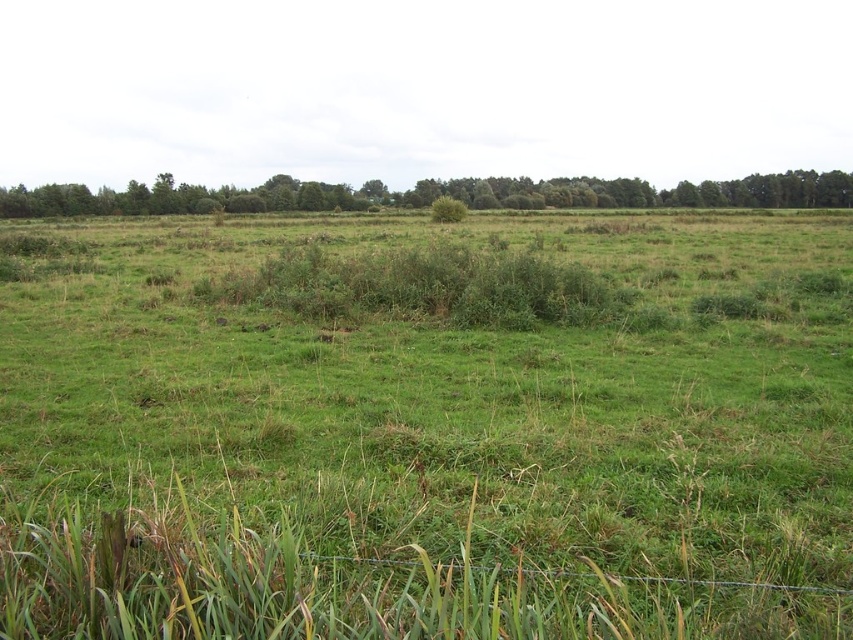
Question: Does green grassy pasture at center appear on the right side of green leafy trees at upper center?

Choices:
 (A) yes
 (B) no

Answer: (A)

Question: Which point is closer to the camera taking this photo?

Choices:
 (A) (35, 465)
 (B) (483, 188)

Answer: (A)

Question: Is green grassy pasture at center closer to camera compared to green leafy trees at upper center?

Choices:
 (A) no
 (B) yes

Answer: (B)

Question: Among these objects, which one is nearest to the camera?

Choices:
 (A) green grassy pasture at center
 (B) green leafy trees at upper center

Answer: (A)

Question: Where is green grassy pasture at center located in relation to green leafy trees at upper center in the image?

Choices:
 (A) below
 (B) above

Answer: (A)